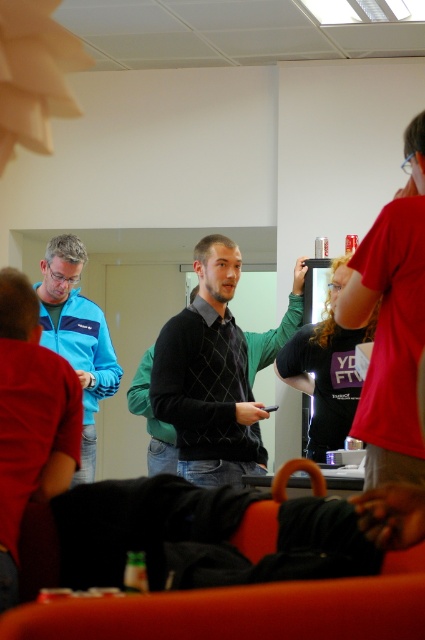
In the scene shown: Does dark gray sweater at center have a greater width compared to blue fabric jacket at left?

Yes.

Is point (187, 307) positioned before point (95, 444)?

Yes.

The height and width of the screenshot is (640, 425). I want to click on dark gray sweater at center, so 209,376.

Does matte black sweater at center have a greater width compared to blue fabric jacket at left?

No, matte black sweater at center is not wider than blue fabric jacket at left.

Does matte black sweater at center appear on the right side of blue fabric jacket at left?

Indeed, matte black sweater at center is positioned on the right side of blue fabric jacket at left.

Is point (371, 301) positioned behind point (39, 294)?

No.

This screenshot has height=640, width=425. I want to click on matte black sweater at center, so click(391, 324).

Measure the distance between matte black sweater at center and dark gray sweater at center.

A distance of 4.13 feet exists between matte black sweater at center and dark gray sweater at center.

Does matte black sweater at center have a smaller size compared to dark gray sweater at center?

Yes.

What are the coordinates of `matte black sweater at center` in the screenshot? It's located at (391, 324).

Where is `matte black sweater at center`? Image resolution: width=425 pixels, height=640 pixels. matte black sweater at center is located at coordinates (391, 324).